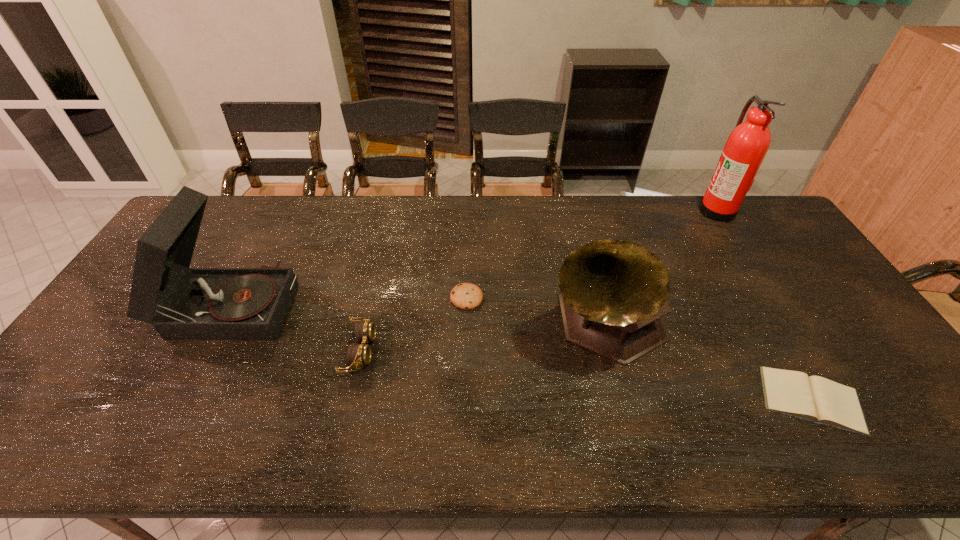
Image resolution: width=960 pixels, height=540 pixels. In order to click on fire extinguisher in this screenshot , I will do `click(747, 145)`.

What are the coordinates of `the tallest object` in the screenshot? It's located at pyautogui.click(x=747, y=145).

Locate an element on the screen. Image resolution: width=960 pixels, height=540 pixels. the left phonograph record is located at coordinates (182, 303).

Where is `the third object from right to left`? the third object from right to left is located at coordinates pos(614,293).

Find the location of a particular element. This screenshot has width=960, height=540. the fifth object from right to left is located at coordinates point(360,354).

The width and height of the screenshot is (960, 540). What are the coordinates of `the fourth tallest object` in the screenshot? It's located at click(360, 354).

Where is `cookie`? The image size is (960, 540). cookie is located at coordinates (467, 296).

Image resolution: width=960 pixels, height=540 pixels. What are the coordinates of `the fourth object from right to left` in the screenshot? It's located at (467, 296).

This screenshot has height=540, width=960. What are the coordinates of `the shortest object` in the screenshot? It's located at (817, 399).

I want to click on vacant space located on the label side of the farthest object, so click(662, 210).